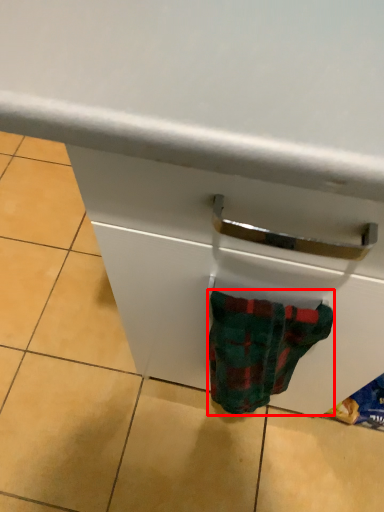
Question: From the image, what is the correct spatial relationship of sock (annotated by the red box) in relation to drawer?

Choices:
 (A) right
 (B) left

Answer: (A)